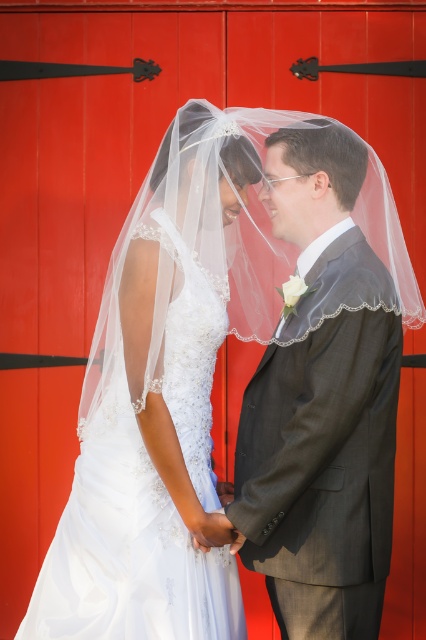
You are a photographer who needs to adjust the lighting for the couple in the image. The gray textured suit at center and the white lace wedding dress at center are both in the frame. Which object is located to the right of the other?

The gray textured suit at center is positioned on the right side of white lace wedding dress at center, so the gray textured suit at center is to the right of the white lace wedding dress at center.

You are a photographer standing in front of the wedding couple. You want to place a small bouquet between them but need to ensure it is placed at the closest point to the camera. Which of the two points, point (252, 465) or point (161, 225), should you choose?

Point (252, 465) is closer to the viewer, so you should place the bouquet there to ensure it is at the closest point to the camera.